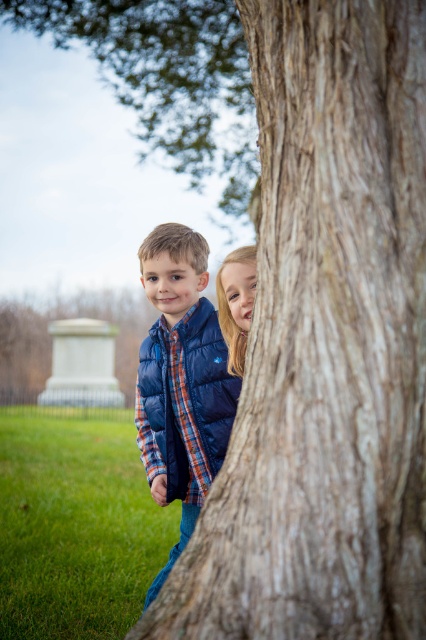
Does brown rough tree trunk at center have a lesser width compared to brown rough bark tree at upper center?

Yes.

Between point (227, 493) and point (43, 12), which one is positioned behind?

The point (43, 12) is more distant.

Identify the location of brown rough tree trunk at center. The height and width of the screenshot is (640, 426). tap(324, 346).

Can you confirm if brown rough bark tree at upper center is shorter than matte blue jacket at center?

No.

Is point (172, 52) behind point (245, 332)?

Yes, it is behind point (245, 332).

Image resolution: width=426 pixels, height=640 pixels. Find the location of `brown rough bark tree at upper center`. brown rough bark tree at upper center is located at coordinates (167, 76).

Can you confirm if navy blue puffer vest at center is positioned to the right of matte blue jacket at center?

Incorrect, navy blue puffer vest at center is not on the right side of matte blue jacket at center.

Does point (169, 221) come closer to viewer compared to point (221, 308)?

No, (169, 221) is behind (221, 308).

You are a GUI agent. You are given a task and a screenshot of the screen. Output one action in this format:
    pyautogui.click(x=<x>, y=<y>)
    Task: Click on the navy blue puffer vest at center
    The image size is (426, 640).
    Given the screenshot: What is the action you would take?
    181,380